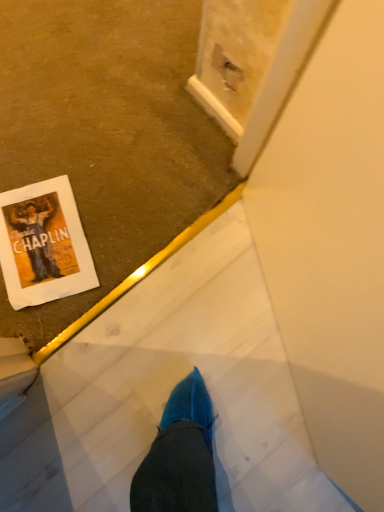
Locate an element on the screen. The image size is (384, 512). free spot behind white paper at lower left is located at coordinates (76, 152).